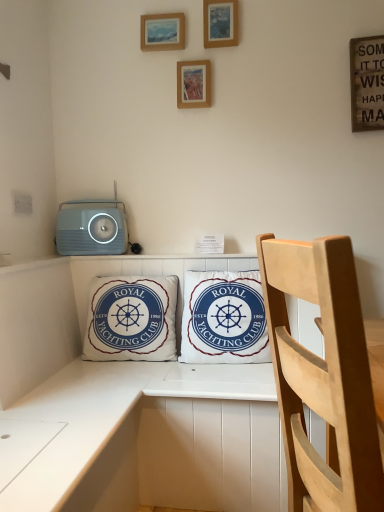
Image resolution: width=384 pixels, height=512 pixels. What do you see at coordinates (163, 32) in the screenshot?
I see `wooden picture frame at upper center, positioned as the 2th picture frame in bottom-to-top order` at bounding box center [163, 32].

The height and width of the screenshot is (512, 384). Describe the element at coordinates (91, 228) in the screenshot. I see `matte gray stereo at upper left` at that location.

The height and width of the screenshot is (512, 384). What do you see at coordinates (323, 375) in the screenshot?
I see `light wood chair at right` at bounding box center [323, 375].

Where is `light wood chair at right`? light wood chair at right is located at coordinates (323, 375).

In order to face wooden picture frame at upper center, the 3th picture frame when ordered from bottom to top, should I rotate leftwards or rightwards?

Turn right by 3.833 degrees to look at wooden picture frame at upper center, the 3th picture frame when ordered from bottom to top.

Find the location of a particular element. This screenshot has width=384, height=512. white cotton pillow at center, the 1th pillow from the right is located at coordinates (224, 318).

What do you see at coordinates (131, 319) in the screenshot? This screenshot has height=512, width=384. I see `white cotton cushion at center, arranged as the 2th pillow when viewed from the right` at bounding box center [131, 319].

This screenshot has height=512, width=384. What are the coordinates of `wooden picture frame at upper center, positioned as the 2th picture frame in bottom-to-top order` in the screenshot? It's located at (163, 32).

Who is taller, matte gray stereo at upper left or white cotton cushion at center, arranged as the 2th pillow when viewed from the right?

With more height is white cotton cushion at center, arranged as the 2th pillow when viewed from the right.

Is point (79, 248) in front of point (168, 352)?

No, (79, 248) is behind (168, 352).

Is matte gray stereo at upper left next to white cotton cushion at center, the 1th pillow in the left-to-right sequence, and touching it?

matte gray stereo at upper left and white cotton cushion at center, the 1th pillow in the left-to-right sequence, are clearly separated.

Between matte gray stereo at upper left and white cotton cushion at center, arranged as the 2th pillow when viewed from the right, which one has smaller size?

Smaller between the two is matte gray stereo at upper left.

Is matte gray stereo at upper left inside wooden picture frame at upper center, positioned as the 2th picture frame in bottom-to-top order?

No.

Locate an element on the screen. This screenshot has width=384, height=512. stereo on the left side of wooden picture frame at upper center, which is the 1th picture frame in left-to-right order is located at coordinates (91, 228).

Which of these two, wooden picture frame at upper center, the third picture frame from the right, or matte gray stereo at upper left, is thinner?

wooden picture frame at upper center, the third picture frame from the right, is thinner.

From the image's perspective, which is below, wooden picture frame at upper center, positioned as the 2th picture frame in bottom-to-top order, or matte gray stereo at upper left?

matte gray stereo at upper left is shown below in the image.

Between point (160, 26) and point (228, 305), which one is positioned behind?

Point (160, 26)

From their relative heights in the image, would you say wooden picture frame at upper center, positioned as the second picture frame in top-to-bottom order, is taller or shorter than white cotton pillow at center, acting as the 2th pillow starting from the left?

In the image, wooden picture frame at upper center, positioned as the second picture frame in top-to-bottom order, appears to be shorter than white cotton pillow at center, acting as the 2th pillow starting from the left.

Considering the relative sizes of wooden picture frame at upper center, positioned as the 2th picture frame in bottom-to-top order, and white cotton pillow at center, the 1th pillow from the right, in the image provided, is wooden picture frame at upper center, positioned as the 2th picture frame in bottom-to-top order, smaller than white cotton pillow at center, the 1th pillow from the right,?

Indeed, wooden picture frame at upper center, positioned as the 2th picture frame in bottom-to-top order, has a smaller size compared to white cotton pillow at center, the 1th pillow from the right.

Does wooden picture frame at upper center, the first picture frame when ordered from bottom to top, have a greater width compared to white cotton pillow at center, the 1th pillow from the right?

Incorrect, the width of wooden picture frame at upper center, the first picture frame when ordered from bottom to top, does not surpass that of white cotton pillow at center, the 1th pillow from the right.

Which object is closer to the camera taking this photo, wooden picture frame at upper center, which appears as the third picture frame when viewed from the top, or white cotton pillow at center, the 1th pillow from the right?

white cotton pillow at center, the 1th pillow from the right, is more forward.

From a real-world perspective, which object stands above the other?

In real-world perspective, wooden picture frame at upper center, the first picture frame when ordered from bottom to top, is above.

Is white cotton pillow at center, the 1th pillow from the right, inside wooden picture frame at upper center, the 2th picture frame from the left?

No, white cotton pillow at center, the 1th pillow from the right, is not inside wooden picture frame at upper center, the 2th picture frame from the left.

From the image's perspective, is white cotton pillow at center, acting as the 2th pillow starting from the left, located above wooden picture frame at upper center, which is the first picture frame in top-to-bottom order?

No.

Does point (196, 355) come behind point (217, 33)?

That is False.

Looking at this image, from a real-world perspective, is light wood chair at right beneath wooden picture frame at upper center, positioned as the 2th picture frame in bottom-to-top order?

Yes, from a real-world perspective, light wood chair at right is beneath wooden picture frame at upper center, positioned as the 2th picture frame in bottom-to-top order.

Is point (367, 481) farther from camera compared to point (177, 26)?

No.

Looking at this image, is wooden picture frame at upper center, which is the 1th picture frame in left-to-right order, surrounded by light wood chair at right?

No, wooden picture frame at upper center, which is the 1th picture frame in left-to-right order, is located outside of light wood chair at right.

What's the angular difference between light wood chair at right and wooden picture frame at upper center, the third picture frame from the right,'s facing directions?

There is a 106-degree angle between the facing directions of light wood chair at right and wooden picture frame at upper center, the third picture frame from the right.

Is light wood chair at right not near wooden picture frame at upper center, placed as the second picture frame when sorted from right to left?

That's right, there is a large distance between light wood chair at right and wooden picture frame at upper center, placed as the second picture frame when sorted from right to left.

Is light wood chair at right looking in the opposite direction of wooden picture frame at upper center, which appears as the third picture frame when viewed from the top?

light wood chair at right is not turned away from wooden picture frame at upper center, which appears as the third picture frame when viewed from the top.

Which of these two, light wood chair at right or wooden picture frame at upper center, the first picture frame when ordered from bottom to top, is bigger?

With larger size is light wood chair at right.

Considering the relative sizes of light wood chair at right and wooden picture frame at upper center, the 2th picture frame from the left, in the image provided, is light wood chair at right shorter than wooden picture frame at upper center, the 2th picture frame from the left,?

No.

Find the location of `stereo above the white cotton cushion at center, the 1th pillow in the left-to-right sequence (from the image's perspective)`. stereo above the white cotton cushion at center, the 1th pillow in the left-to-right sequence (from the image's perspective) is located at coordinates (91, 228).

The width and height of the screenshot is (384, 512). I want to click on stereo behind the wooden picture frame at upper center, which is the 1th picture frame in left-to-right order, so click(x=91, y=228).

Estimate the real-world distances between objects in this image. Which object is closer to white cotton pillow at center, the 1th pillow from the right, wooden picture frame at upper center, which is the third picture frame from left to right, or wooden picture frame at upper center, placed as the second picture frame when sorted from right to left?

wooden picture frame at upper center, placed as the second picture frame when sorted from right to left, is closer to white cotton pillow at center, the 1th pillow from the right.

Based on their spatial positions, is white cotton cushion at center, arranged as the 2th pillow when viewed from the right, or matte gray stereo at upper left closer to wooden picture frame at upper center, which appears as the third picture frame when viewed from the top?

Based on the image, matte gray stereo at upper left appears to be nearer to wooden picture frame at upper center, which appears as the third picture frame when viewed from the top.

Which object lies nearer to the anchor point wooden picture frame at upper center, the 2th picture frame from the left, white cotton pillow at center, acting as the 2th pillow starting from the left, or matte gray stereo at upper left?

matte gray stereo at upper left is closer to wooden picture frame at upper center, the 2th picture frame from the left.

Estimate the real-world distances between objects in this image. Which object is further from wooden picture frame at upper center, the third picture frame from the right, light wood chair at right or white cotton cushion at center, the 1th pillow in the left-to-right sequence?

Based on the image, light wood chair at right appears to be further to wooden picture frame at upper center, the third picture frame from the right.

Which object lies further to the anchor point wooden picture frame at upper center, the third picture frame from the right, white cotton pillow at center, the 1th pillow from the right, or light wood chair at right?

Based on the image, light wood chair at right appears to be further to wooden picture frame at upper center, the third picture frame from the right.

Estimate the real-world distances between objects in this image. Which object is further from wooden picture frame at upper center, which is the third picture frame from left to right, white cotton cushion at center, the 1th pillow in the left-to-right sequence, or wooden picture frame at upper center, placed as the second picture frame when sorted from right to left?

white cotton cushion at center, the 1th pillow in the left-to-right sequence, is positioned further to the anchor wooden picture frame at upper center, which is the third picture frame from left to right.

Which object lies nearer to the anchor point wooden picture frame at upper center, the 3th picture frame when ordered from bottom to top, white cotton cushion at center, arranged as the 2th pillow when viewed from the right, or light wood chair at right?

white cotton cushion at center, arranged as the 2th pillow when viewed from the right, is positioned closer to the anchor wooden picture frame at upper center, the 3th picture frame when ordered from bottom to top.

Estimate the real-world distances between objects in this image. Which object is further from light wood chair at right, white cotton pillow at center, the 1th pillow from the right, or wooden picture frame at upper center, arranged as the 1th picture frame when viewed from the right?

wooden picture frame at upper center, arranged as the 1th picture frame when viewed from the right, is further to light wood chair at right.

Find the location of a particular element. picture frame positioned between light wood chair at right and wooden picture frame at upper center, positioned as the second picture frame in top-to-bottom order, from near to far is located at coordinates (220, 23).

Find the location of a particular element. This screenshot has height=512, width=384. pillow between light wood chair at right and white cotton cushion at center, arranged as the 2th pillow when viewed from the right, from front to back is located at coordinates (224, 318).

This screenshot has width=384, height=512. Find the location of `stereo between wooden picture frame at upper center, which is the 1th picture frame in left-to-right order, and white cotton cushion at center, arranged as the 2th pillow when viewed from the right, from top to bottom`. stereo between wooden picture frame at upper center, which is the 1th picture frame in left-to-right order, and white cotton cushion at center, arranged as the 2th pillow when viewed from the right, from top to bottom is located at coordinates (91, 228).

You are a GUI agent. You are given a task and a screenshot of the screen. Output one action in this format:
    pyautogui.click(x=<x>, y=<y>)
    Task: Click on the stereo between wooden picture frame at upper center, which appears as the third picture frame when viewed from the top, and white cotton pillow at center, acting as the 2th pillow starting from the left, in the up-down direction
    This screenshot has width=384, height=512.
    Given the screenshot: What is the action you would take?
    pyautogui.click(x=91, y=228)